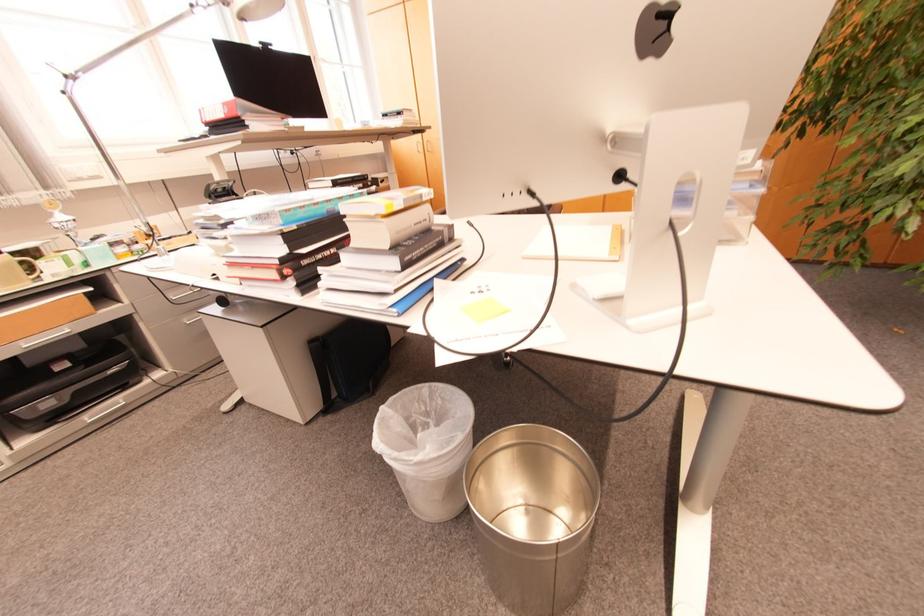
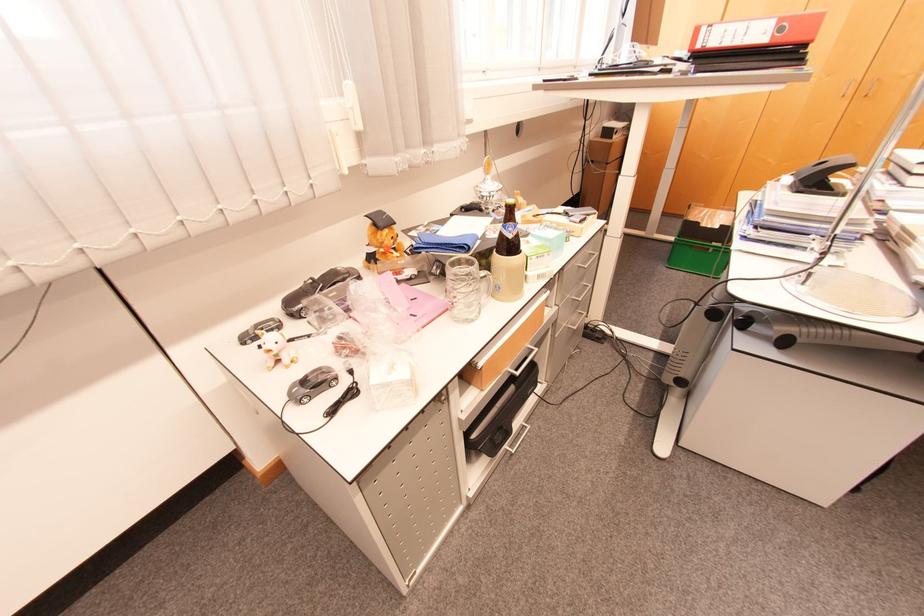
Question: What movement of the cameraman would produce the second image?

Choices:
 (A) Left
 (B) Right
 (C) Forward
 (D) Backward

Answer: (A)